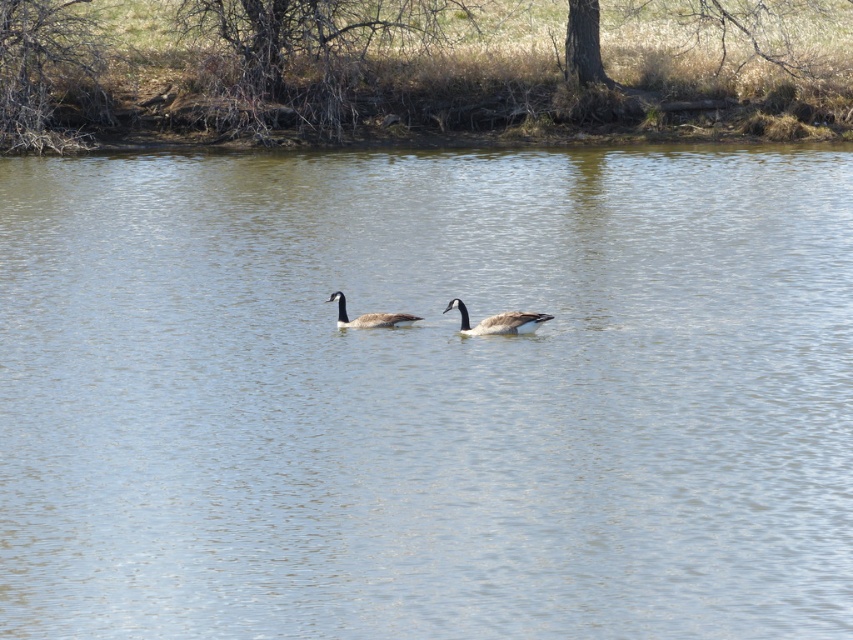
Question: Which object is closer to the camera taking this photo?

Choices:
 (A) brown feathered duck at center
 (B) brown speckled duck at center

Answer: (B)

Question: Does brown speckled duck at center have a smaller size compared to brown feathered duck at center?

Choices:
 (A) yes
 (B) no

Answer: (B)

Question: Which point appears farthest from the camera in this image?

Choices:
 (A) (373, 312)
 (B) (515, 324)

Answer: (A)

Question: From the image, what is the correct spatial relationship of brown speckled duck at center in relation to brown feathered duck at center?

Choices:
 (A) left
 (B) right

Answer: (B)

Question: Can you confirm if brown speckled duck at center is positioned above brown feathered duck at center?

Choices:
 (A) no
 (B) yes

Answer: (A)

Question: Which of the following is the farthest from the observer?

Choices:
 (A) (474, 333)
 (B) (338, 291)

Answer: (B)